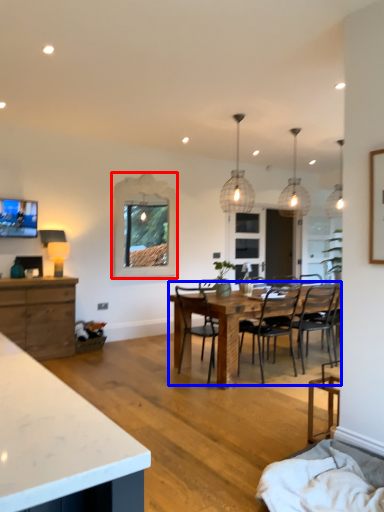
Question: Which of the following is the closest to the observer, window (highlighted by a red box) or kitchen & dining room table (highlighted by a blue box)?

Choices:
 (A) window
 (B) kitchen & dining room table

Answer: (B)